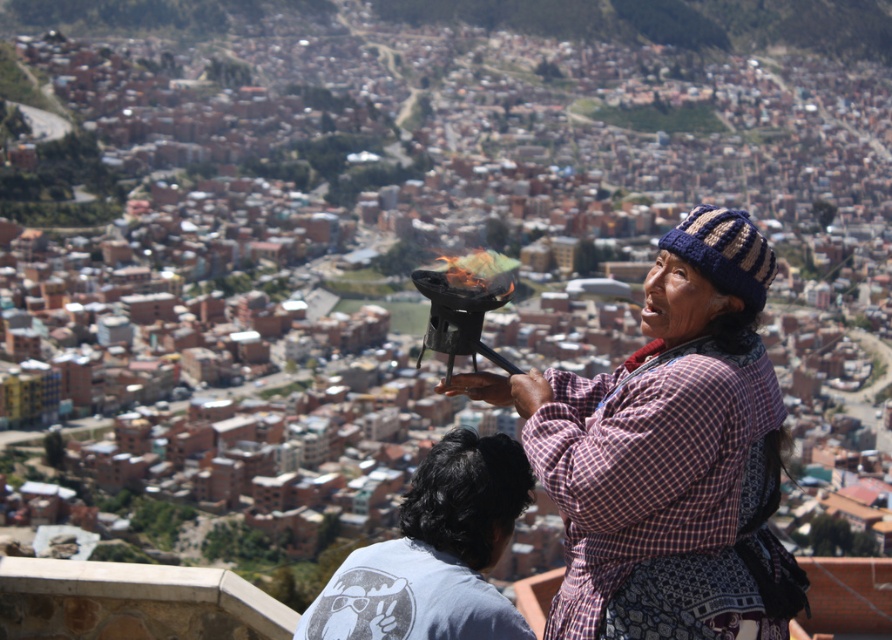
You are a photographer taking a picture of the plaid fabric shawl at center and the gray cotton shirt at lower left. Which object should you focus on first if you want to capture both in the frame without moving the camera?

You should focus on the plaid fabric shawl at center first because it has a greater height compared to the gray cotton shirt at lower left, so it will occupy more space in the frame.